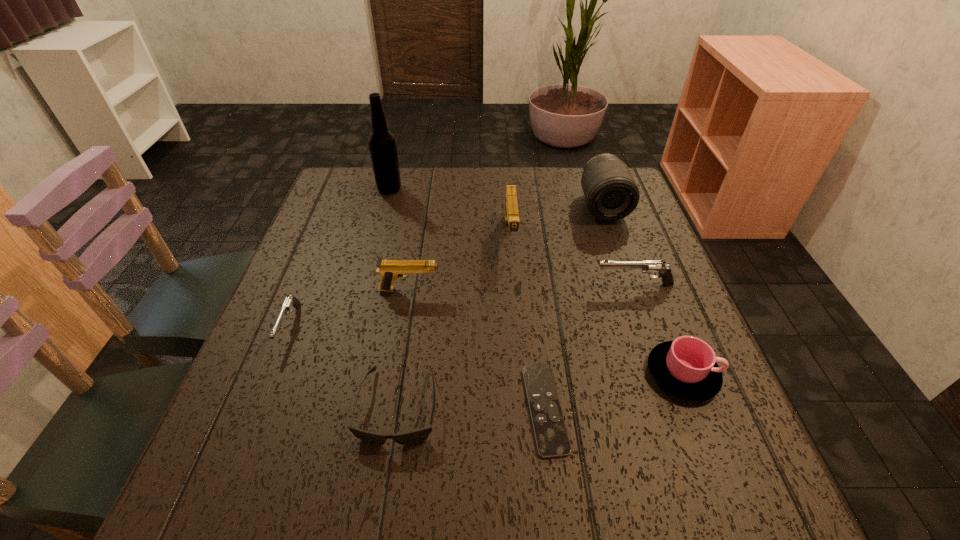
Identify the location of vacant space located on the front-facing side of the rightmost pistol. (437, 285).

The height and width of the screenshot is (540, 960). In order to click on free space located 0.300m on the front-facing side of the leftmost pistol in this screenshot , I will do `click(213, 517)`.

Locate an element on the screen. The height and width of the screenshot is (540, 960). free region located on the front-facing side of the sunglasses is located at coordinates (386, 492).

In order to click on vacant space located on the left of the shortest object in this screenshot , I will do `click(379, 409)`.

I want to click on beer bottle at the far edge, so click(x=382, y=145).

At what (x,y) coordinates should I click in order to perform the action: click on telephoto lens present at the far edge. Please return your answer as a coordinate pair (x, y). This screenshot has width=960, height=540. Looking at the image, I should click on (x=611, y=193).

Find the location of `beer bottle present at the left edge`. beer bottle present at the left edge is located at coordinates (382, 145).

The width and height of the screenshot is (960, 540). What are the coordinates of `pistol located in the left edge section of the desktop` in the screenshot? It's located at (290, 302).

The height and width of the screenshot is (540, 960). In order to click on telephoto lens that is at the right edge in this screenshot , I will do `click(611, 193)`.

This screenshot has width=960, height=540. I want to click on pistol situated at the right edge, so click(649, 267).